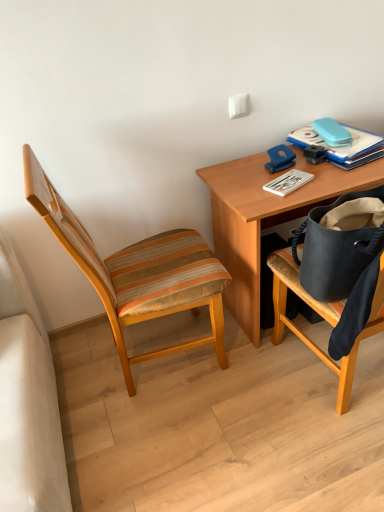
Question: Is white matte paperback book at upper right, the second paperback book when ordered from right to left, outside of wooden desk at upper right?

Choices:
 (A) yes
 (B) no

Answer: (B)

Question: Is white matte paperback book at upper right, which is the 2th paperback book from top to bottom, facing towards wooden desk at upper right?

Choices:
 (A) no
 (B) yes

Answer: (B)

Question: Is white matte paperback book at upper right, the second paperback book when ordered from right to left, taller than wooden desk at upper right?

Choices:
 (A) yes
 (B) no

Answer: (B)

Question: From the image's perspective, is white matte paperback book at upper right, which is the first paperback book from bottom to top, located beneath wooden desk at upper right?

Choices:
 (A) no
 (B) yes

Answer: (A)

Question: Is white matte paperback book at upper right, which is the first paperback book from bottom to top, to the left of wooden desk at upper right from the viewer's perspective?

Choices:
 (A) no
 (B) yes

Answer: (B)

Question: Looking at their shapes, would you say blue hardcover book at upper right, the first paperback book from the top, is wider or thinner than white matte paperback book at upper right, the second paperback book when ordered from right to left?

Choices:
 (A) thin
 (B) wide

Answer: (B)

Question: Is blue hardcover book at upper right, arranged as the 2th paperback book when ordered from the bottom, taller or shorter than white matte paperback book at upper right, positioned as the first paperback book in left-to-right order?

Choices:
 (A) tall
 (B) short

Answer: (A)

Question: In the image, is blue hardcover book at upper right, placed as the second paperback book when sorted from left to right, positioned in front of or behind white matte paperback book at upper right, which is the 2th paperback book from top to bottom?

Choices:
 (A) behind
 (B) front

Answer: (A)

Question: Visually, is blue hardcover book at upper right, placed as the second paperback book when sorted from left to right, positioned to the left or to the right of white matte paperback book at upper right, which is the first paperback book from bottom to top?

Choices:
 (A) left
 (B) right

Answer: (B)

Question: Is wooden striped chair at left spatially inside white matte paperback book at upper right, which is the first paperback book from bottom to top, or outside of it?

Choices:
 (A) inside
 (B) outside

Answer: (B)

Question: Is wooden striped chair at left to the left or to the right of white matte paperback book at upper right, the second paperback book when ordered from right to left, in the image?

Choices:
 (A) left
 (B) right

Answer: (A)

Question: In the image, is wooden striped chair at left positioned in front of or behind white matte paperback book at upper right, positioned as the first paperback book in left-to-right order?

Choices:
 (A) behind
 (B) front

Answer: (B)

Question: In terms of size, does wooden striped chair at left appear bigger or smaller than white matte paperback book at upper right, which is the first paperback book from bottom to top?

Choices:
 (A) big
 (B) small

Answer: (A)

Question: From the image's perspective, is white matte paperback book at upper right, the second paperback book when ordered from right to left, located above or below wooden striped chair at left?

Choices:
 (A) above
 (B) below

Answer: (A)

Question: Based on their sizes in the image, would you say white matte paperback book at upper right, positioned as the first paperback book in left-to-right order, is bigger or smaller than wooden striped chair at left?

Choices:
 (A) big
 (B) small

Answer: (B)